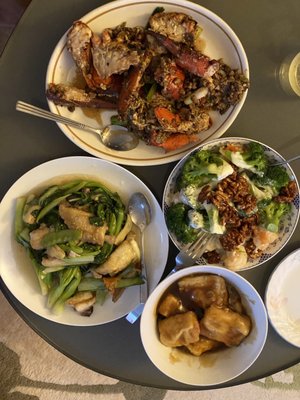
Identify the location of small bowl. Image resolution: width=300 pixels, height=400 pixels. (240, 366).